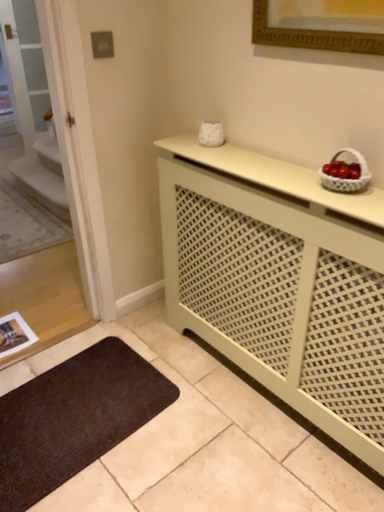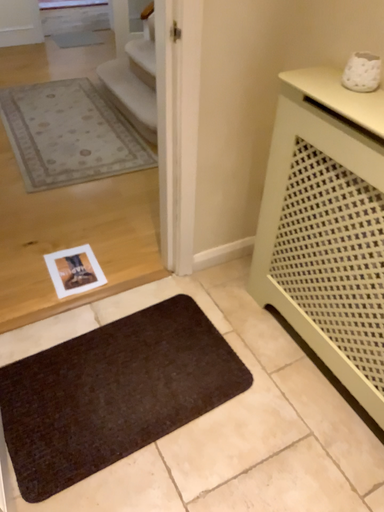
Question: Which way did the camera rotate in the video?

Choices:
 (A) rotated downward
 (B) rotated upward

Answer: (A)